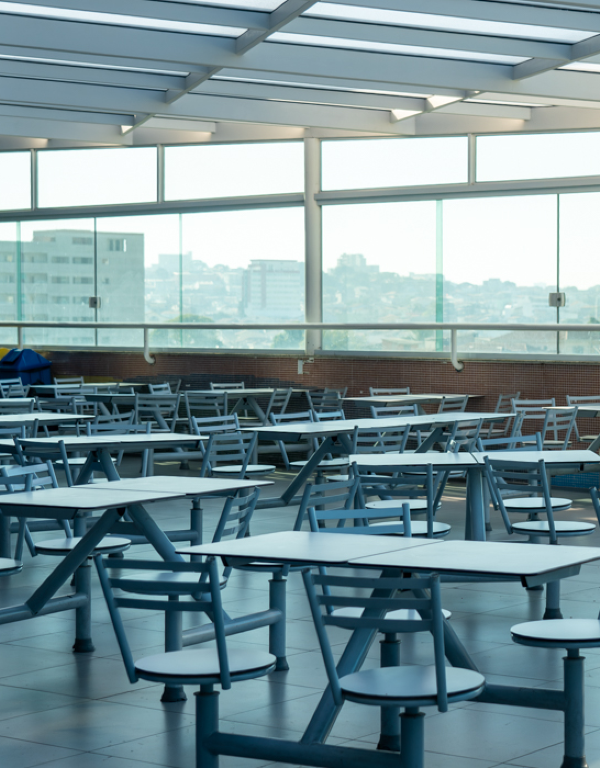
Where is `chair`? The image size is (600, 768). chair is located at coordinates (173, 664), (388, 702), (550, 627), (412, 598), (58, 543), (9, 557), (416, 500), (421, 525), (542, 531), (253, 462).